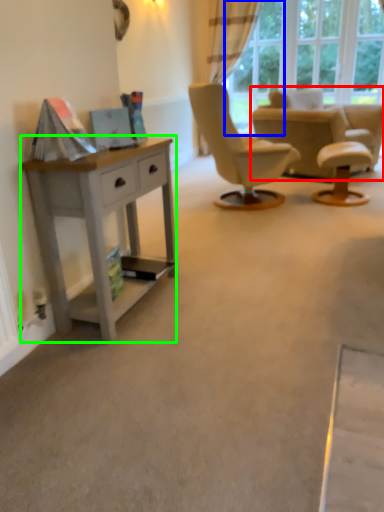
Question: Which object is the closest to the chair (highlighted by a red box)? Choose among these: glass door (highlighted by a blue box) or desk (highlighted by a green box).

Choices:
 (A) glass door
 (B) desk

Answer: (A)